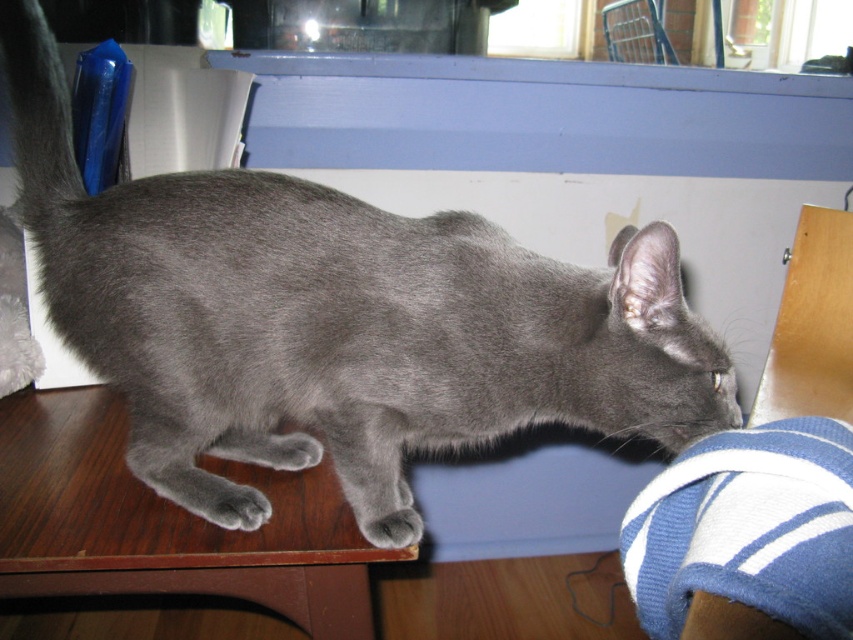
Question: Does wooden table at lower left appear on the left side of silvery-gray fur tail at left?

Choices:
 (A) yes
 (B) no

Answer: (B)

Question: Estimate the real-world distances between objects in this image. Which object is closer to the silvery-gray fur tail at left?

Choices:
 (A) gray fur paw at lower center
 (B) wooden table at lower left

Answer: (B)

Question: From the image, what is the correct spatial relationship of wooden table at lower left in relation to silvery-gray fur tail at left?

Choices:
 (A) left
 (B) right

Answer: (B)

Question: Can you confirm if silvery-gray fur tail at left is smaller than gray fur paw at lower left?

Choices:
 (A) no
 (B) yes

Answer: (A)

Question: Estimate the real-world distances between objects in this image. Which object is farther from the gray fur paw at lower center?

Choices:
 (A) wooden table at lower left
 (B) silvery-gray fur tail at left

Answer: (B)

Question: Which object appears closest to the camera in this image?

Choices:
 (A) gray fur paw at lower center
 (B) wooden table at lower left
 (C) silvery-gray fur tail at left
 (D) gray fur paw at lower left

Answer: (B)